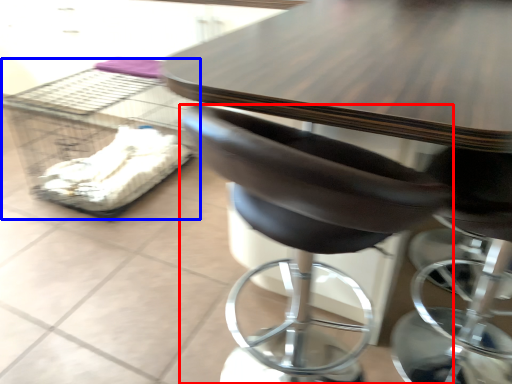
Question: Which object is further to the camera taking this photo, chair (highlighted by a red box) or crate (highlighted by a blue box)?

Choices:
 (A) chair
 (B) crate

Answer: (B)